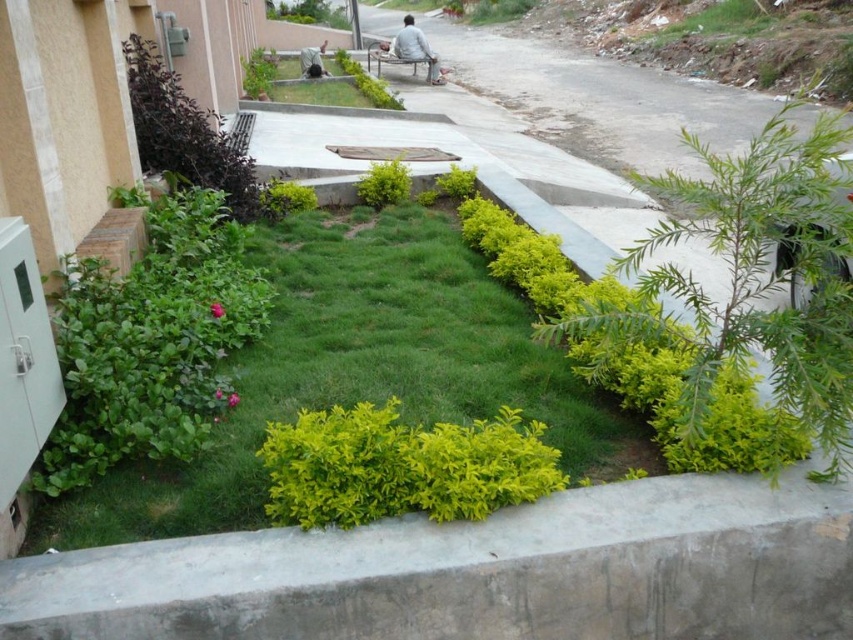
Question: Considering the relative positions of light gray fabric bench at center and wooden bench at center in the image provided, where is light gray fabric bench at center located with respect to wooden bench at center?

Choices:
 (A) below
 (B) above

Answer: (B)

Question: Can you confirm if light gray fabric bench at center is bigger than wooden bench at center?

Choices:
 (A) no
 (B) yes

Answer: (B)

Question: Which of the following is the closest to the observer?

Choices:
 (A) (408, 61)
 (B) (415, 36)

Answer: (B)

Question: Is light gray fabric bench at center wider than wooden bench at center?

Choices:
 (A) no
 (B) yes

Answer: (B)